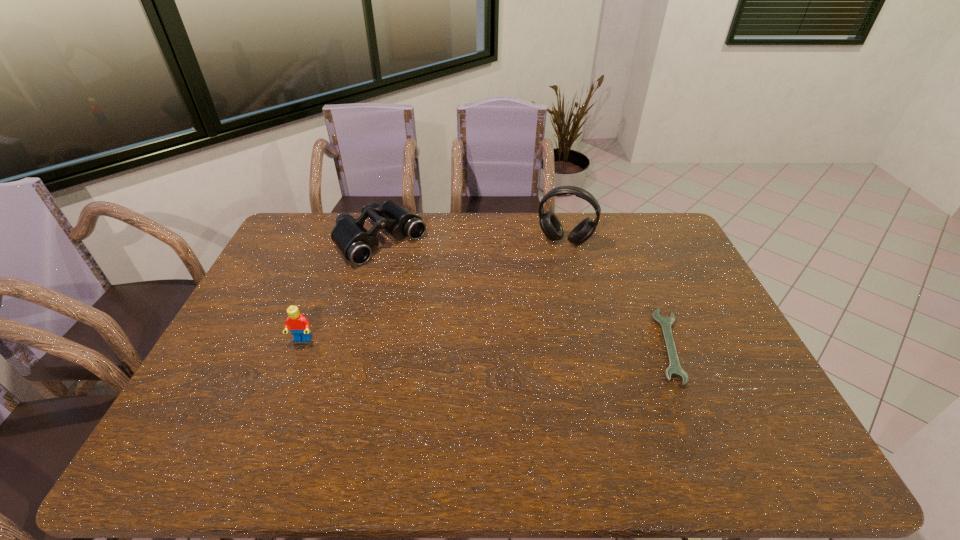
Image resolution: width=960 pixels, height=540 pixels. I want to click on Lego, so click(298, 325).

This screenshot has width=960, height=540. I want to click on wrench, so click(674, 369).

You are a GUI agent. You are given a task and a screenshot of the screen. Output one action in this format:
    pyautogui.click(x=<x>, y=<y>)
    Task: Click on the shortest object
    
    Given the screenshot: What is the action you would take?
    pyautogui.click(x=674, y=369)

This screenshot has height=540, width=960. In order to click on binoculars in this screenshot , I will do `click(356, 243)`.

Identify the location of the tallest object. (549, 223).

Where is `the second object from right to left`? The height and width of the screenshot is (540, 960). the second object from right to left is located at coordinates (549, 223).

At what (x,y) coordinates should I click in order to perform the action: click on vacant space situated on the face of the Lego. Please return your answer as a coordinate pair (x, y). This screenshot has height=540, width=960. Looking at the image, I should click on pos(293,366).

What are the coordinates of `vacant space positioned on the right of the wrench` in the screenshot? It's located at (708, 346).

Locate an element on the screen. free space located 0.100m on the front-facing side of the binoculars is located at coordinates (422, 277).

Image resolution: width=960 pixels, height=540 pixels. I want to click on vacant space located on the front-facing side of the binoculars, so click(468, 317).